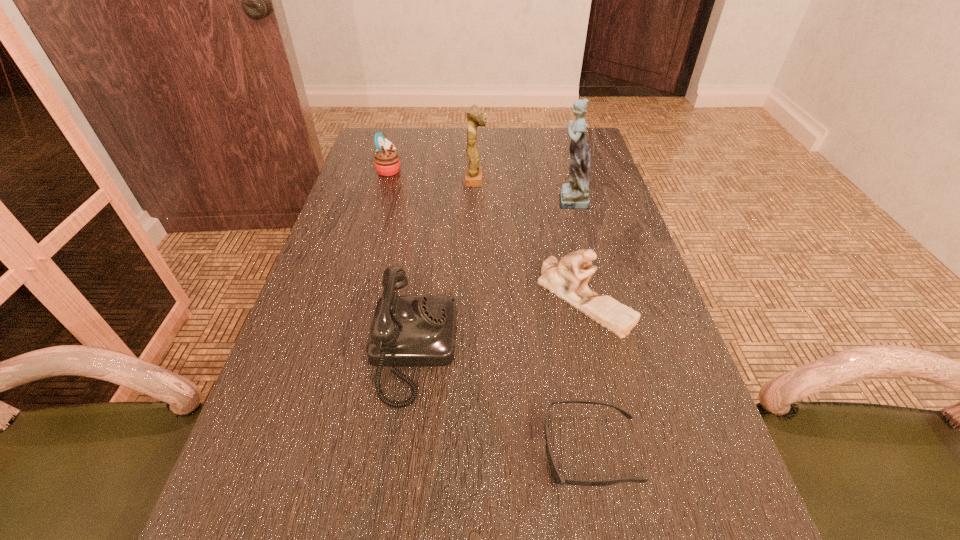
Where is `vacant position located 0.290m on the front-facing side of the tallest object`? The image size is (960, 540). vacant position located 0.290m on the front-facing side of the tallest object is located at coordinates (444, 199).

This screenshot has width=960, height=540. What are the coordinates of `vacant space positioned on the front-facing side of the tallest object` in the screenshot? It's located at (425, 199).

This screenshot has height=540, width=960. In order to click on vacant space located on the front-facing side of the leftmost figurine in this screenshot , I will do `click(568, 180)`.

Image resolution: width=960 pixels, height=540 pixels. What are the coordinates of `free space located 0.300m on the front-facing side of the nearest figurine` in the screenshot? It's located at (631, 498).

Find the location of a particular element. vacant point located on the dial of the telephone is located at coordinates (605, 349).

I want to click on vacant position located 0.310m on the front-facing side of the leftmost object, so click(504, 170).

Find the location of a particular element. Image resolution: width=960 pixels, height=540 pixels. vacant space located on the front-facing side of the nearest object is located at coordinates (308, 450).

Find the location of a particular element. vacant area located 0.360m on the front-facing side of the nearest object is located at coordinates (321, 450).

Where is `vacant space located 0.340m on the front-facing side of the nearest object`? vacant space located 0.340m on the front-facing side of the nearest object is located at coordinates (333, 450).

Find the location of a particular element. The width and height of the screenshot is (960, 540). object that is at the far edge is located at coordinates (386, 160).